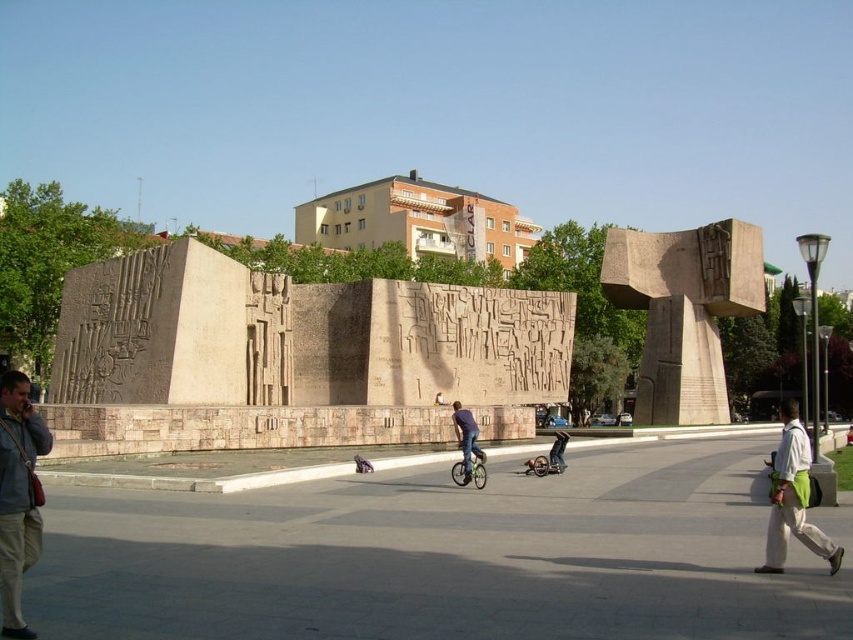
You are a photographer standing in the plaza and want to capture both the gray fabric jacket at lower left and the denim pants at center in your shot. Which object should you focus on first if you want to ensure both are in frame?

You should focus on the gray fabric jacket at lower left first because it is taller than the denim pants at center, so adjusting the frame to include its height will naturally accommodate the shorter denim pants at center.

A city planner wants to install a new bench in the plaza such that it is equidistant from the smooth gray stone sculpture at center and the nearest building. Is this possible given the current layout?

The smooth gray stone sculpture at center and the nearest building are 87.46 meters apart. To place a bench equidistant from both, it would need to be placed exactly halfway between them, which is 43.73 meters from each. This is possible as long as there is unobstructed space along the midpoint path in the plaza.

Looking at this image, you are a photographer standing in the plaza and want to capture both the white cotton shirt at lower right and the denim pants at center in a single photo. Which object should you focus on first to ensure both are in frame?

You should focus on the denim pants at center first because the white cotton shirt at lower right is positioned under it, so adjusting the camera angle to include the denim pants will naturally include the shirt beneath.